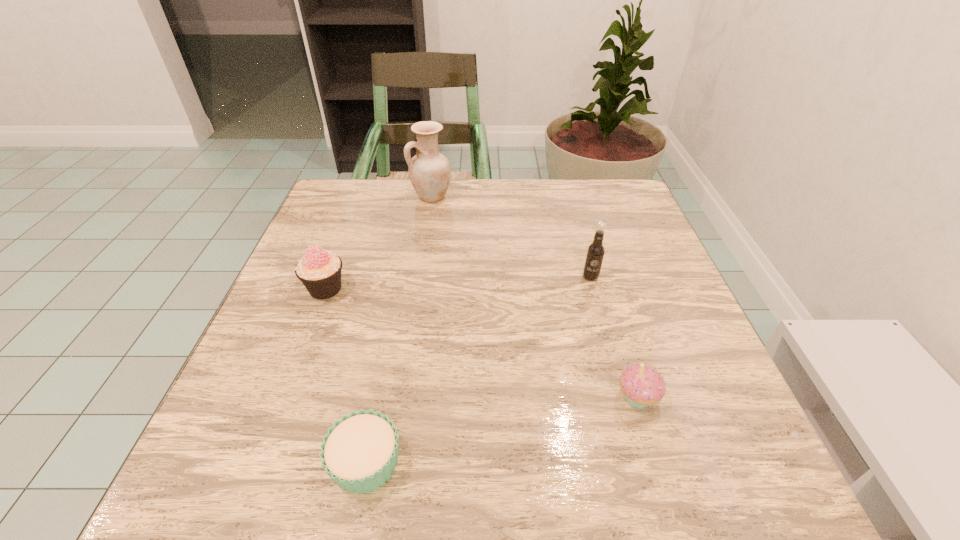
Locate an element on the screen. the tallest object is located at coordinates (429, 171).

Locate an element on the screen. Image resolution: width=960 pixels, height=540 pixels. the farthest object is located at coordinates (429, 171).

Locate an element on the screen. The width and height of the screenshot is (960, 540). the second tallest object is located at coordinates (595, 252).

Where is `the leftmost object`? This screenshot has height=540, width=960. the leftmost object is located at coordinates (319, 270).

This screenshot has width=960, height=540. Find the location of `the leftmost cupcake`. the leftmost cupcake is located at coordinates (319, 270).

I want to click on the second nearest object, so click(642, 385).

Where is `the second farthest cupcake`? This screenshot has height=540, width=960. the second farthest cupcake is located at coordinates (642, 385).

Locate an element on the screen. The image size is (960, 540). the second cupcake from left to right is located at coordinates (360, 452).

Identify the location of the shortest cupcake. The image size is (960, 540). (360, 452).

Find the location of a particular element. vacant space located 0.190m on the left of the farthest object is located at coordinates (341, 197).